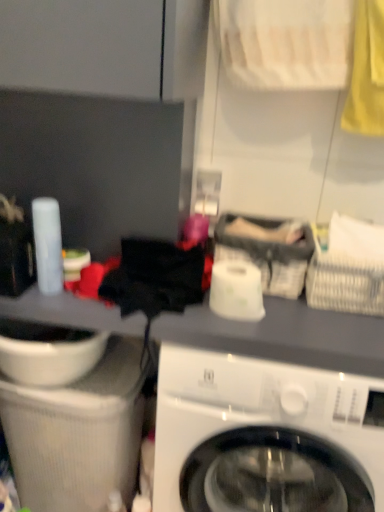
Question: Can you confirm if white glossy washing machine at center is shorter than white woven basket at upper right, the 2th basket from the left?

Choices:
 (A) yes
 (B) no

Answer: (B)

Question: From the image's perspective, is white glossy washing machine at center located beneath white woven basket at upper right, which is the first basket in right-to-left order?

Choices:
 (A) no
 (B) yes

Answer: (B)

Question: Is white glossy washing machine at center placed right next to white woven basket at upper right, which is the first basket in right-to-left order?

Choices:
 (A) yes
 (B) no

Answer: (B)

Question: Does white glossy washing machine at center lie behind white woven basket at upper right, which is the first basket in right-to-left order?

Choices:
 (A) no
 (B) yes

Answer: (A)

Question: Are white glossy washing machine at center and white woven basket at upper right, which is the first basket in right-to-left order, far apart?

Choices:
 (A) no
 (B) yes

Answer: (A)

Question: In terms of width, does white woven basket at upper right, which is the first basket in right-to-left order, look wider or thinner when compared to white glossy toilet paper at center?

Choices:
 (A) thin
 (B) wide

Answer: (B)

Question: Is white woven basket at upper right, which is the first basket in right-to-left order, taller or shorter than white glossy toilet paper at center?

Choices:
 (A) tall
 (B) short

Answer: (A)

Question: From a real-world perspective, relative to white glossy toilet paper at center, is white woven basket at upper right, the 2th basket from the left, vertically above or below?

Choices:
 (A) above
 (B) below

Answer: (A)

Question: Is point pyautogui.click(x=331, y=258) closer or farther from the camera than point pyautogui.click(x=238, y=263)?

Choices:
 (A) closer
 (B) farther

Answer: (B)

Question: In the image, is gray fabric basket at center, which ranks as the 1th basket in left-to-right order, positioned in front of or behind white glossy sink at lower left?

Choices:
 (A) behind
 (B) front

Answer: (B)

Question: From the image's perspective, is gray fabric basket at center, which ranks as the 1th basket in left-to-right order, located above or below white glossy sink at lower left?

Choices:
 (A) below
 (B) above

Answer: (B)

Question: Is gray fabric basket at center, the second basket when ordered from right to left, wider or thinner than white glossy sink at lower left?

Choices:
 (A) thin
 (B) wide

Answer: (A)

Question: Considering the positions of gray fabric basket at center, which ranks as the 1th basket in left-to-right order, and white glossy sink at lower left in the image, is gray fabric basket at center, which ranks as the 1th basket in left-to-right order, bigger or smaller than white glossy sink at lower left?

Choices:
 (A) big
 (B) small

Answer: (B)

Question: Is point (216, 309) positioned closer to the camera than point (349, 501)?

Choices:
 (A) farther
 (B) closer

Answer: (B)

Question: Considering the positions of white glossy toilet paper at center and white glossy washing machine at center in the image, is white glossy toilet paper at center taller or shorter than white glossy washing machine at center?

Choices:
 (A) short
 (B) tall

Answer: (A)